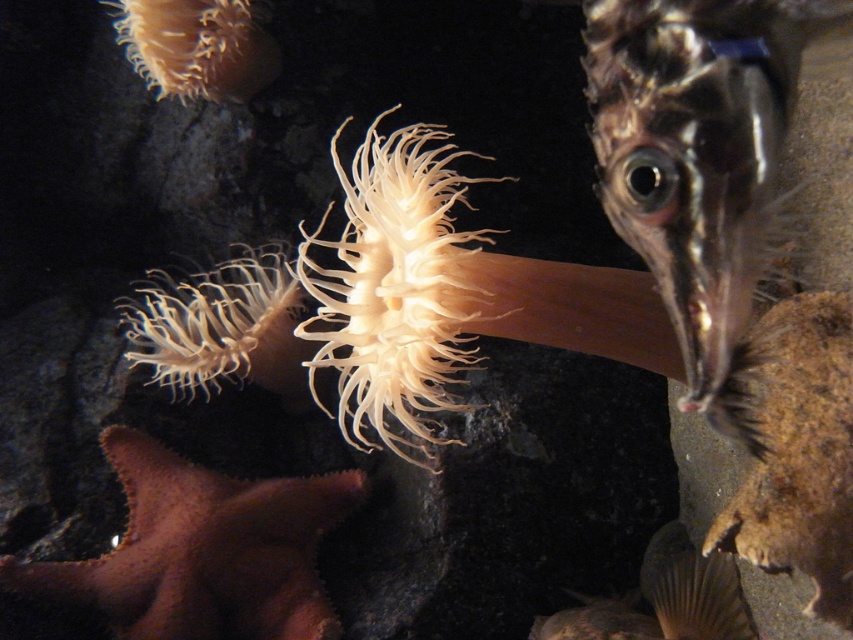
Question: Can you confirm if shiny silver fish at center is smaller than translucent white anemone at center?

Choices:
 (A) yes
 (B) no

Answer: (A)

Question: Is shiny silver fish at center behind translucent white anemone at center?

Choices:
 (A) yes
 (B) no

Answer: (B)

Question: Which point appears closest to the camera in this image?

Choices:
 (A) (248, 378)
 (B) (643, 6)

Answer: (B)

Question: Among these points, which one is nearest to the camera?

Choices:
 (A) (721, 92)
 (B) (128, 307)

Answer: (A)

Question: Is shiny silver fish at center positioned in front of translucent white anemone at center?

Choices:
 (A) no
 (B) yes

Answer: (B)